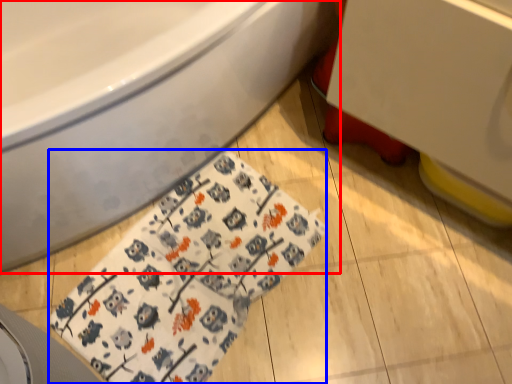
Question: Which of the following is the farthest to the observer, bathtub (highlighted by a red box) or blanket (highlighted by a blue box)?

Choices:
 (A) bathtub
 (B) blanket

Answer: (B)